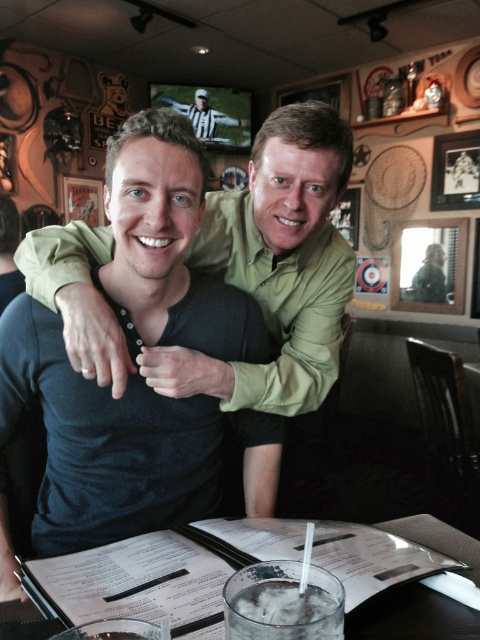
This screenshot has width=480, height=640. Identify the location of green matte shirt at center. (275, 268).

Is green matte shirt at center thinner than clear plastic cup at center?

In fact, green matte shirt at center might be wider than clear plastic cup at center.

Describe the element at coordinates (275, 268) in the screenshot. I see `green matte shirt at center` at that location.

Where is `green matte shirt at center`? This screenshot has width=480, height=640. green matte shirt at center is located at coordinates (275, 268).

Between green matte shirt at center and clear glass at center, which one has more height?

green matte shirt at center

Is green matte shirt at center closer to camera compared to clear glass at center?

No.

Does point (312, 180) lie behind point (113, 630)?

Yes, point (312, 180) is farther from viewer.

In order to click on green matte shirt at center in this screenshot , I will do `click(275, 268)`.

Which is more to the right, clear glass ice at table center or clear glass at center?

Positioned to the right is clear glass ice at table center.

Does point (237, 609) come closer to viewer compared to point (130, 625)?

No, it is behind (130, 625).

The height and width of the screenshot is (640, 480). What are the coordinates of `clear glass ice at table center` in the screenshot? It's located at (283, 612).